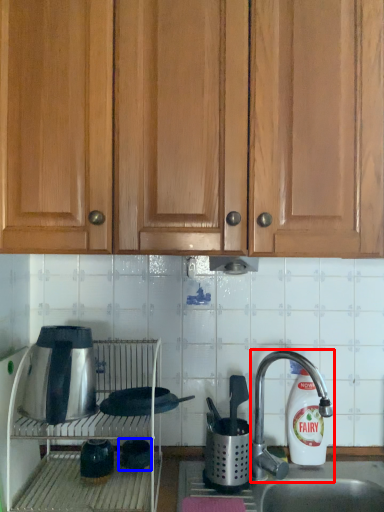
Question: Which of the following is the farthest to the observer, faucet (highlighted by a red box) or appliance (highlighted by a blue box)?

Choices:
 (A) faucet
 (B) appliance

Answer: (B)